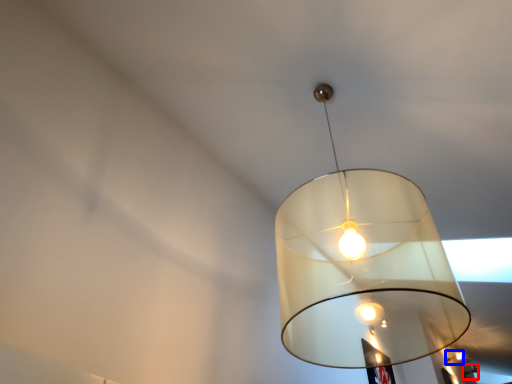
Question: Which object appears farthest to the camera in this image, lamp (highlighted by a red box) or lamp (highlighted by a blue box)?

Choices:
 (A) lamp
 (B) lamp

Answer: (A)